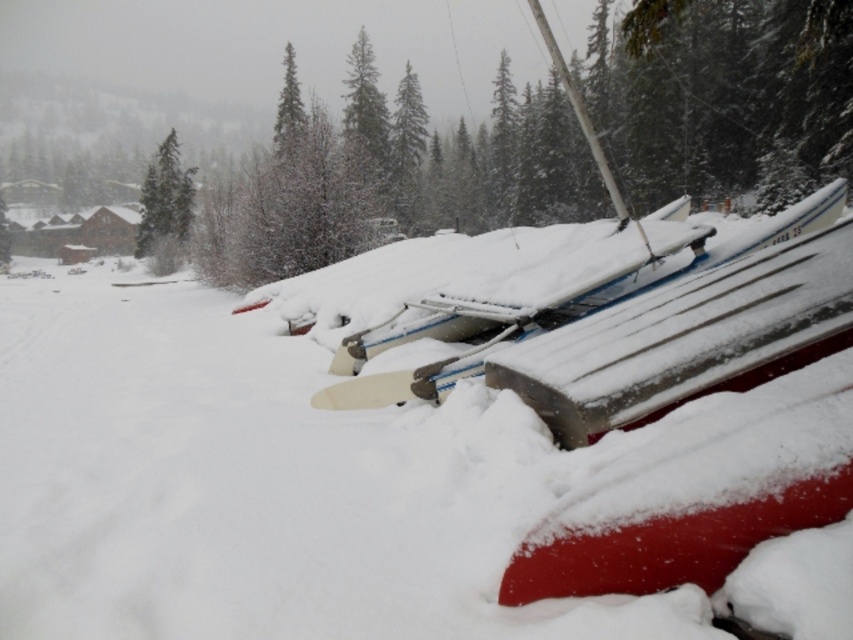
Can you confirm if white fluffy snow at center is positioned below green matte tree at upper left?

Indeed, white fluffy snow at center is positioned under green matte tree at upper left.

Which of these two, white fluffy snow at center or green matte tree at upper left, stands taller?

With more height is green matte tree at upper left.

Is point (172, 572) in front of point (161, 262)?

Yes, point (172, 572) is in front of point (161, 262).

Locate an element on the screen. white fluffy snow at center is located at coordinates (312, 486).